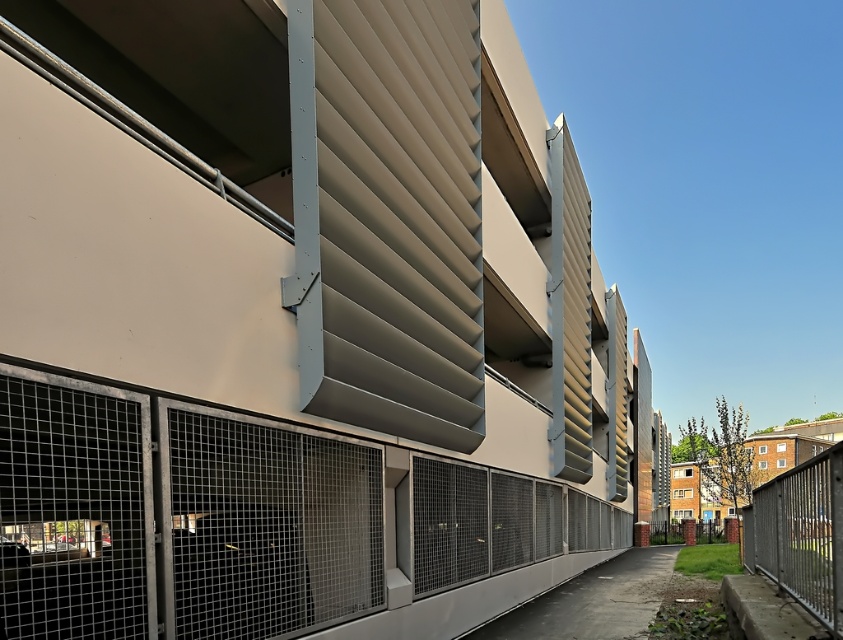
You are standing in front of the modern parking garage. You need to locate the metal mesh fence at center. Where exactly is it positioned in the image?

The metal mesh fence at center is positioned at point 0.820 on the x axis and 0.306 on the y axis.

You are a delivery person trying to see through the fences in the image. Which fence, the metal mesh fence at center or the metallic silver fence at lower right, allows you to see more clearly through it?

The metallic silver fence at lower right allows you to see more clearly through it because it has a lower height than the metal mesh fence at center.